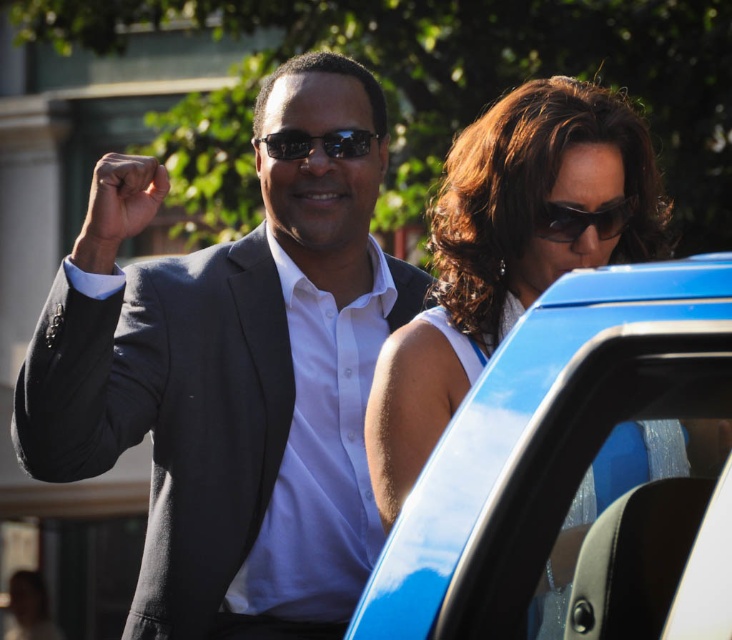
Question: Which point is farther from the camera taking this photo?

Choices:
 (A) (619, 204)
 (B) (343, 74)
 (C) (447, 497)
 (D) (366, 150)

Answer: (B)

Question: Does matte black suit at center have a greater width compared to black reflective sunglasses at center?

Choices:
 (A) yes
 (B) no

Answer: (A)

Question: Which is farther from the blue glossy car door at center-right?

Choices:
 (A) matte black suit at center
 (B) black reflective sunglasses at center
 (C) sunglasses at center

Answer: (B)

Question: Does matte black suit at center appear under sunglasses at center?

Choices:
 (A) no
 (B) yes

Answer: (B)

Question: Which point is farther to the camera?

Choices:
 (A) sunglasses at center
 (B) matte black suit at center
 (C) black reflective sunglasses at center
 (D) blue glossy car door at center-right

Answer: (C)

Question: Does matte black suit at center appear under sunglasses at center?

Choices:
 (A) yes
 (B) no

Answer: (A)